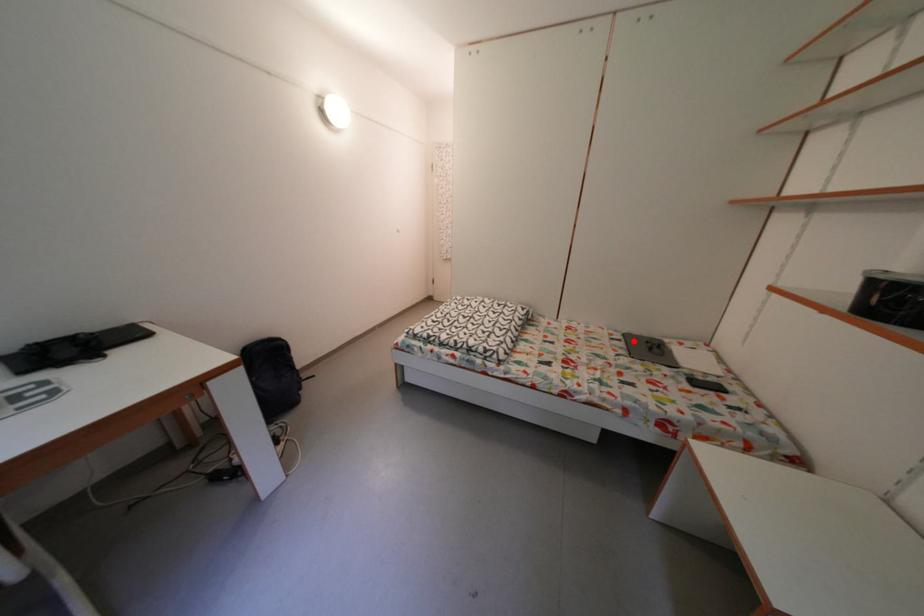
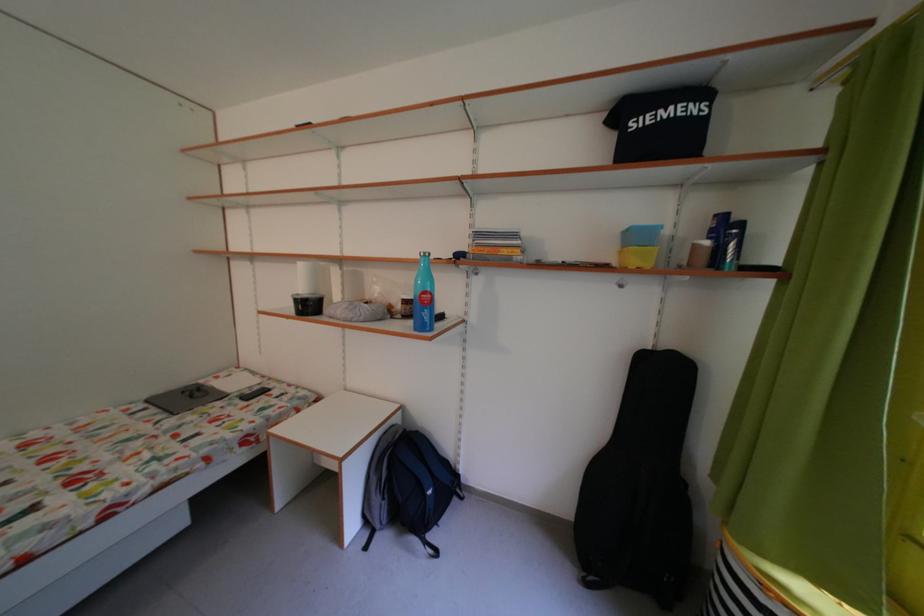
Where in the second image is the point corresponding to the highlighted location from the first image?

(156, 407)